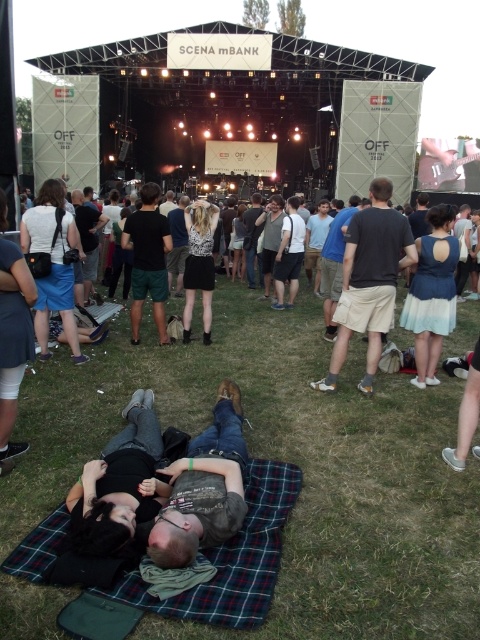
Which is behind, point (118, 451) or point (429, 349)?

Point (429, 349)

Is point (100, 481) in front of point (415, 291)?

Yes, point (100, 481) is closer to viewer.

Where is `black matte shirt at lower left`? This screenshot has width=480, height=640. black matte shirt at lower left is located at coordinates (120, 484).

Which of these two, plaid fabric blanket at lower center or white cotton shirt at center, stands taller?

Standing taller between the two is white cotton shirt at center.

Does plaid fabric blanket at lower center lie behind white cotton shirt at center?

No.

Is point (223, 598) closer to viewer compared to point (56, 241)?

Yes, point (223, 598) is in front of point (56, 241).

You are a GUI agent. You are given a task and a screenshot of the screen. Output one action in this format:
    pyautogui.click(x=<x>, y=<y>)
    Task: Click on the plaid fabric blanket at lower center
    This screenshot has height=640, width=480.
    Given the screenshot: What is the action you would take?
    pyautogui.click(x=232, y=557)

Is black matte shirt at lower left shorter than black cotton t-shirt at center?

Indeed, black matte shirt at lower left has a lesser height compared to black cotton t-shirt at center.

Where is `black matte shirt at lower left`? The height and width of the screenshot is (640, 480). black matte shirt at lower left is located at coordinates (120, 484).